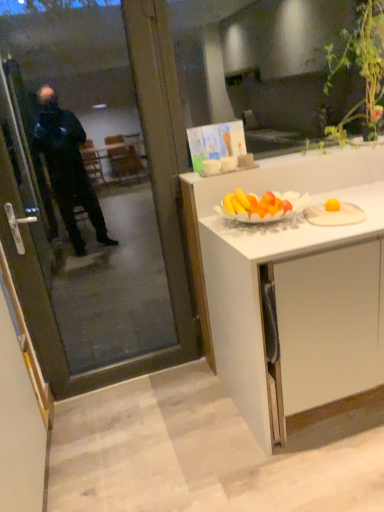
Question: From a real-world perspective, is transparent glass screen door at left located higher than white wooden plate at right?

Choices:
 (A) no
 (B) yes

Answer: (B)

Question: Can we say transparent glass screen door at left lies outside white wooden plate at right?

Choices:
 (A) yes
 (B) no

Answer: (A)

Question: Can you confirm if transparent glass screen door at left is positioned to the left of white wooden plate at right?

Choices:
 (A) yes
 (B) no

Answer: (A)

Question: Is the depth of transparent glass screen door at left less than that of white wooden plate at right?

Choices:
 (A) yes
 (B) no

Answer: (A)

Question: Is transparent glass screen door at left directly adjacent to white wooden plate at right?

Choices:
 (A) yes
 (B) no

Answer: (B)

Question: Could you tell me if transparent glass screen door at left is turned towards white wooden plate at right?

Choices:
 (A) yes
 (B) no

Answer: (B)

Question: Is green leafy plant at upper right directly adjacent to transparent glass screen door at left?

Choices:
 (A) yes
 (B) no

Answer: (B)

Question: Does green leafy plant at upper right have a smaller size compared to transparent glass screen door at left?

Choices:
 (A) no
 (B) yes

Answer: (B)

Question: Is green leafy plant at upper right to the left of transparent glass screen door at left from the viewer's perspective?

Choices:
 (A) no
 (B) yes

Answer: (A)

Question: From the image's perspective, is green leafy plant at upper right located beneath transparent glass screen door at left?

Choices:
 (A) yes
 (B) no

Answer: (B)

Question: From a real-world perspective, is green leafy plant at upper right located beneath transparent glass screen door at left?

Choices:
 (A) no
 (B) yes

Answer: (A)

Question: Considering the relative sizes of green leafy plant at upper right and transparent glass screen door at left in the image provided, is green leafy plant at upper right thinner than transparent glass screen door at left?

Choices:
 (A) no
 (B) yes

Answer: (A)

Question: From a real-world perspective, is white wooden plate at right beneath green leafy plant at upper right?

Choices:
 (A) yes
 (B) no

Answer: (A)